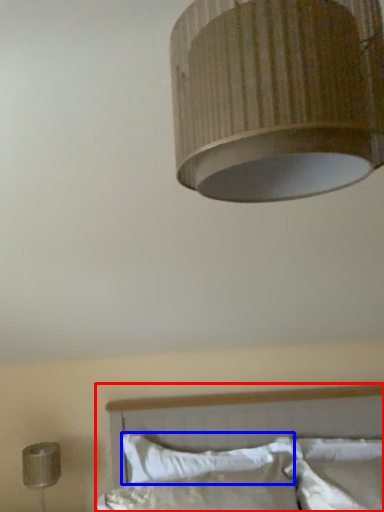
Question: Which of the following is the closest to the observer, bed (highlighted by a red box) or pillow (highlighted by a blue box)?

Choices:
 (A) bed
 (B) pillow

Answer: (A)